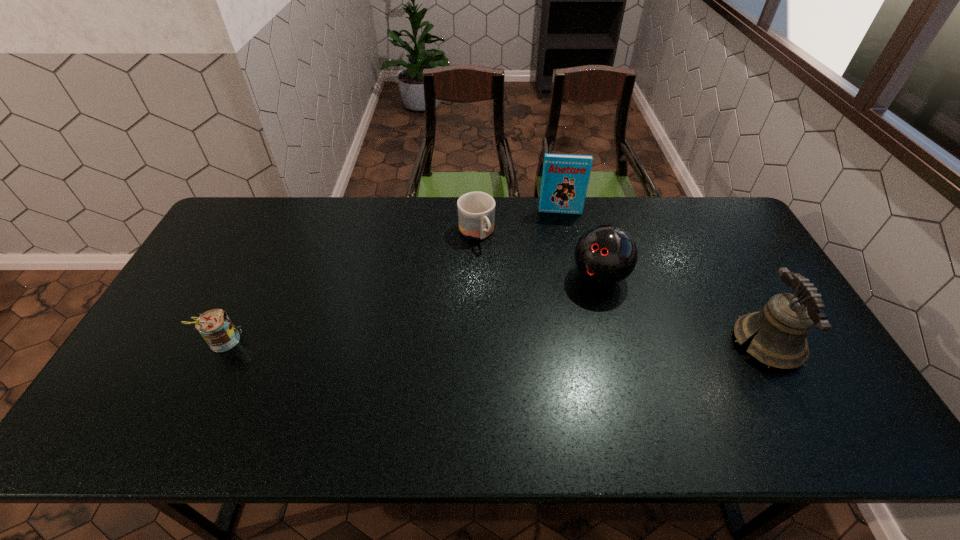
Find the location of a particular element. the leftmost object is located at coordinates (215, 326).

I want to click on the rightmost object, so click(781, 327).

Locate an element on the screen. This screenshot has height=540, width=960. the fourth object from right to left is located at coordinates (476, 210).

The image size is (960, 540). Identify the location of mug. point(476,210).

At what (x,y) coordinates should I click in order to perform the action: click on book. Please return your answer as a coordinate pair (x, y). Looking at the image, I should click on (565, 178).

Where is `the third tallest object`? the third tallest object is located at coordinates (605, 255).

Find the location of `the third nearest object`. the third nearest object is located at coordinates (605, 255).

The image size is (960, 540). In order to click on free space located on the left of the leftmost object in this screenshot , I will do `click(148, 342)`.

Find the location of a particular element. This screenshot has width=960, height=540. free space located 0.380m on the back of the rightmost object is located at coordinates (704, 230).

The image size is (960, 540). In order to click on vacant space located on the side with the handle of the fourth object from right to left in this screenshot , I will do `click(510, 287)`.